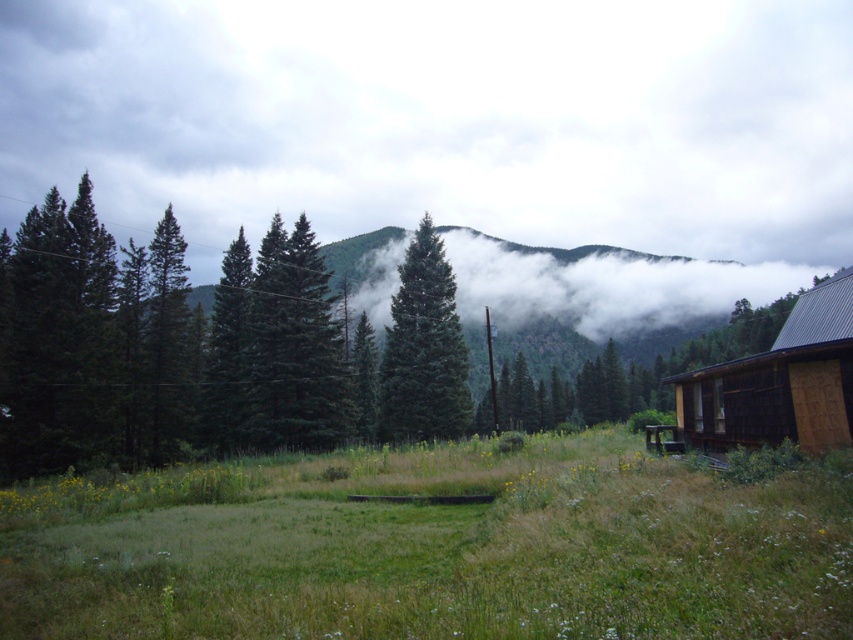
From the picture: Does green grassy field at center lie in front of wooden cabin at right?

Yes, green grassy field at center is closer to the viewer.

Which of these two, green grassy field at center or wooden cabin at right, stands shorter?

Standing shorter between the two is green grassy field at center.

At what (x,y) coordinates should I click in order to perform the action: click on green grassy field at center. Please return your answer as a coordinate pair (x, y). The width and height of the screenshot is (853, 640). Looking at the image, I should click on (434, 547).

Is point (711, 435) more distant than point (355, 337)?

No.

How distant is wooden cabin at right from green matte tree at center?

41.32 meters

The width and height of the screenshot is (853, 640). Describe the element at coordinates (779, 381) in the screenshot. I see `wooden cabin at right` at that location.

You are a GUI agent. You are given a task and a screenshot of the screen. Output one action in this format:
    pyautogui.click(x=<x>, y=<y>)
    Task: Click on the wooden cabin at right
    This screenshot has height=640, width=853.
    Given the screenshot: What is the action you would take?
    [779, 381]

The image size is (853, 640). Describe the element at coordinates (422, 349) in the screenshot. I see `green matte evergreen tree at center` at that location.

Between green matte evergreen tree at center and green matte tree at center, which one has less height?

green matte tree at center is shorter.

Locate an element on the screen. Image resolution: width=853 pixels, height=640 pixels. green matte evergreen tree at center is located at coordinates (422, 349).